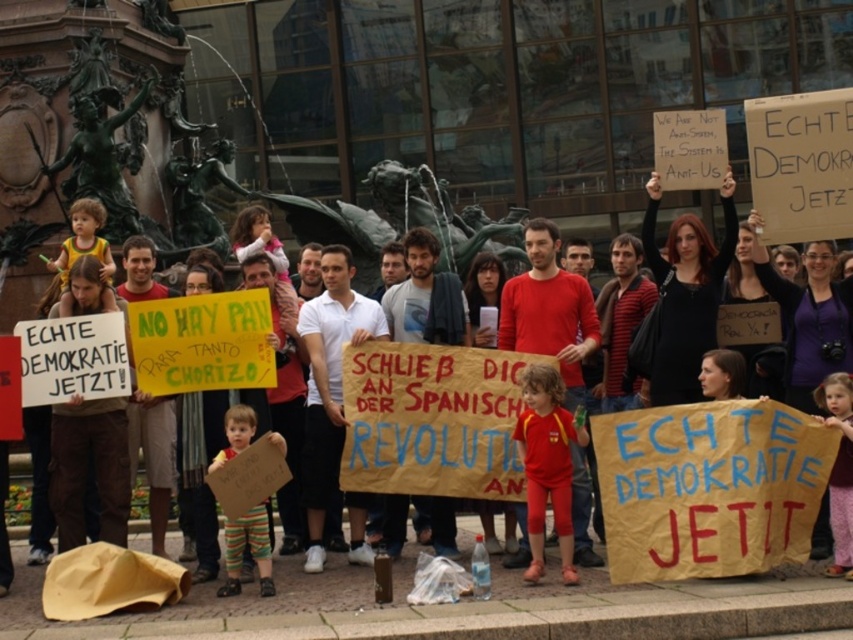
Who is taller, matte red t-shirt at center or yellow cotton shirt at left?

yellow cotton shirt at left is taller.

Is matte red t-shirt at center positioned before yellow cotton shirt at left?

Yes, matte red t-shirt at center is in front of yellow cotton shirt at left.

Is point (537, 440) positioned in front of point (84, 236)?

Yes, point (537, 440) is closer to viewer.

Locate an element on the screen. Image resolution: width=853 pixels, height=640 pixels. matte red t-shirt at center is located at coordinates (547, 464).

Is point (233, 451) farther from camera compared to point (836, 424)?

That is True.

Can you confirm if striped cotton pants at lower center is positioned to the left of dusty pink fabric at lower right?

Correct, you'll find striped cotton pants at lower center to the left of dusty pink fabric at lower right.

Looking at this image, who is more forward, [254,506] or [844,502]?

Positioned in front is point [844,502].

This screenshot has height=640, width=853. Find the location of `striped cotton pants at lower center`. striped cotton pants at lower center is located at coordinates (248, 548).

Is point (845, 388) positioned behind point (85, 218)?

No, (845, 388) is closer to viewer.

Is dusty pink fabric at lower right below yellow cotton shirt at left?

Indeed, dusty pink fabric at lower right is positioned under yellow cotton shirt at left.

I want to click on dusty pink fabric at lower right, so click(839, 468).

In order to click on dusty pink fabric at lower right in this screenshot , I will do `click(839, 468)`.